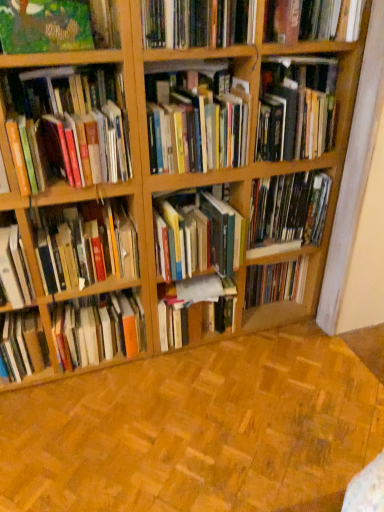
What do you see at coordinates (196, 234) in the screenshot?
I see `hardcover books at center, the eighth book from the top` at bounding box center [196, 234].

The width and height of the screenshot is (384, 512). I want to click on hardcover book at center, which is the twelfth book from top to bottom, so click(x=196, y=310).

What do you see at coordinates (275, 282) in the screenshot?
I see `hardcover book at center, positioned as the eleventh book in top-to-bottom order` at bounding box center [275, 282].

The width and height of the screenshot is (384, 512). Identify the location of hardcover book at center, marked as the third book in a bottom-to-top arrangement. (275, 282).

Locate an element on the screen. The image size is (384, 512). hardcover books at left, acting as the 8th book starting from the bottom is located at coordinates (67, 126).

Locate an element on the screen. The height and width of the screenshot is (512, 384). hardcover books at center, which appears as the sixth book when ordered from the bottom is located at coordinates (196, 234).

Does point (120, 352) come behind point (40, 160)?

Yes.

From the picture: Choose the correct answer: Is hardcover book at center, the first book ordered from the bottom, inside hardcover books at left, acting as the 8th book starting from the bottom, or outside it?

hardcover book at center, the first book ordered from the bottom, lies outside hardcover books at left, acting as the 8th book starting from the bottom.

Considering the relative sizes of hardcover book at center, which is the 13th book in top-to-bottom order, and hardcover books at left, the 6th book in the top-to-bottom sequence, in the image provided, is hardcover book at center, which is the 13th book in top-to-bottom order, taller than hardcover books at left, the 6th book in the top-to-bottom sequence,?

Yes.

Which object is thinner, hardcover book at center, which is the 13th book in top-to-bottom order, or hardcover books at left, acting as the 8th book starting from the bottom?

Thinner between the two is hardcover books at left, acting as the 8th book starting from the bottom.

Can you see hardcover books at center, marked as the 9th book in a bottom-to-top arrangement, touching hardcover books at left, the 6th book in the top-to-bottom sequence?

hardcover books at center, marked as the 9th book in a bottom-to-top arrangement, and hardcover books at left, the 6th book in the top-to-bottom sequence, are not in contact.

Considering the sizes of objects hardcover books at center, placed as the 5th book when sorted from top to bottom, and hardcover books at left, the 6th book in the top-to-bottom sequence, in the image provided, who is smaller, hardcover books at center, placed as the 5th book when sorted from top to bottom, or hardcover books at left, the 6th book in the top-to-bottom sequence,?

Smaller between the two is hardcover books at center, placed as the 5th book when sorted from top to bottom.

Is hardcover books at center, placed as the 5th book when sorted from top to bottom, completely or partially outside of hardcover books at left, the 6th book in the top-to-bottom sequence?

That's correct, hardcover books at center, placed as the 5th book when sorted from top to bottom, is outside of hardcover books at left, the 6th book in the top-to-bottom sequence.

Can you tell me how much hardcover books at center, placed as the 5th book when sorted from top to bottom, and hardcover books at left, acting as the 8th book starting from the bottom, differ in facing direction?

The angular difference between hardcover books at center, placed as the 5th book when sorted from top to bottom, and hardcover books at left, acting as the 8th book starting from the bottom, is 0.000763 degrees.

From the hardcover book at center, positioned as the eleventh book in top-to-bottom order, count the 3rd book to the left and point to it. Please provide its 2D coordinates.

[(196, 234)]

Is hardcover book at center, marked as the third book in a bottom-to-top arrangement, thinner than hardcover books at center, the eighth book from the top?

Indeed, hardcover book at center, marked as the third book in a bottom-to-top arrangement, has a lesser width compared to hardcover books at center, the eighth book from the top.

Looking at this image, in the image, is hardcover book at center, marked as the third book in a bottom-to-top arrangement, positioned in front of or behind hardcover books at center, which appears as the sixth book when ordered from the bottom?

hardcover book at center, marked as the third book in a bottom-to-top arrangement, is behind hardcover books at center, which appears as the sixth book when ordered from the bottom.

Is hardcover book at upper right, marked as the fourth book in a top-to-bottom arrangement, facing towards hardcover book at lower left, placed as the 10th book when sorted from top to bottom?

No, hardcover book at upper right, marked as the fourth book in a top-to-bottom arrangement, does not turn towards hardcover book at lower left, placed as the 10th book when sorted from top to bottom.

Which is further, (311, 153) or (24, 291)?

The point (311, 153) is farther.

From the picture: Measure the distance between hardcover book at upper right, the 10th book ordered from the bottom, and hardcover book at lower left, placed as the 10th book when sorted from top to bottom.

A distance of 1.03 meters exists between hardcover book at upper right, the 10th book ordered from the bottom, and hardcover book at lower left, placed as the 10th book when sorted from top to bottom.

From a real-world perspective, count 5th books upward from the hardcover book at lower left, the 4th book positioned from the bottom, and point to it. Please provide its 2D coordinates.

[(296, 108)]

Considering the points (136, 263) and (144, 341), which point is behind, point (136, 263) or point (144, 341)?

The point (144, 341) is farther.

Between hardcover book at center-left, which is the ninth book from top to bottom, and hardcover book at center, the first book ordered from the bottom, which one has smaller width?

Thinner between the two is hardcover book at center-left, which is the ninth book from top to bottom.

From a real-world perspective, does hardcover book at center-left, the 5th book when ordered from bottom to top, sit lower than hardcover book at center, which is the 13th book in top-to-bottom order?

No.

Where is `the 2nd book in front of the hardcover book at center, which is the 13th book in top-to-bottom order, counting from the anchor's position`? Image resolution: width=384 pixels, height=512 pixels. the 2nd book in front of the hardcover book at center, which is the 13th book in top-to-bottom order, counting from the anchor's position is located at coordinates (85, 246).

Between point (300, 259) and point (272, 217), which one is positioned behind?

The point (300, 259) is behind.

Can you confirm if hardcover book at center, positioned as the eleventh book in top-to-bottom order, is taller than hardcover book at center, the 7th book viewed from the top?

No, hardcover book at center, positioned as the eleventh book in top-to-bottom order, is not taller than hardcover book at center, the 7th book viewed from the top.

Considering the relative positions of hardcover book at center, marked as the third book in a bottom-to-top arrangement, and hardcover book at center, the 7th book viewed from the top, in the image provided, is hardcover book at center, marked as the third book in a bottom-to-top arrangement, to the left of hardcover book at center, the 7th book viewed from the top, from the viewer's perspective?

No, hardcover book at center, marked as the third book in a bottom-to-top arrangement, is not to the left of hardcover book at center, the 7th book viewed from the top.

Considering the relative sizes of hardcover book at upper right, the 10th book ordered from the bottom, and hardcover books at left, the 6th book in the top-to-bottom sequence, in the image provided, is hardcover book at upper right, the 10th book ordered from the bottom, smaller than hardcover books at left, the 6th book in the top-to-bottom sequence,?

Actually, hardcover book at upper right, the 10th book ordered from the bottom, might be larger than hardcover books at left, the 6th book in the top-to-bottom sequence.

From the image's perspective, is hardcover book at upper right, marked as the fourth book in a top-to-bottom arrangement, beneath hardcover books at left, acting as the 8th book starting from the bottom?

No, from the image's perspective, hardcover book at upper right, marked as the fourth book in a top-to-bottom arrangement, is not beneath hardcover books at left, acting as the 8th book starting from the bottom.

Consider the image. Is hardcover book at upper right, marked as the fourth book in a top-to-bottom arrangement, far from hardcover books at left, the 6th book in the top-to-bottom sequence?

No.

Is hardcover book at upper right, the 10th book ordered from the bottom, looking in the opposite direction of hardcover books at left, acting as the 8th book starting from the bottom?

That's not correct — hardcover book at upper right, the 10th book ordered from the bottom, is not looking away from hardcover books at left, acting as the 8th book starting from the bottom.

In order to click on the 7th book located above the hardcover book at center, the first book ordered from the bottom (from a real-world perspective) in this screenshot , I will do `click(67, 126)`.

Locate an element on the screen. the 3rd book counting from the right side of the hardcover books at left, acting as the 8th book starting from the bottom is located at coordinates (197, 120).

Looking at the image, which one is located further to hardcover book at center-left, which is the ninth book from top to bottom, hardcover book at center, which is the twelfth book from top to bottom, or hardcover book at upper right, marked as the fourth book in a top-to-bottom arrangement?

hardcover book at upper right, marked as the fourth book in a top-to-bottom arrangement.

Looking at the image, which one is located further to hardcover book at lower left, placed as the 10th book when sorted from top to bottom, hardcover book at center-left, the 5th book when ordered from bottom to top, or hardcover book at center, placed as the 7th book when sorted from bottom to top?

The object further to hardcover book at lower left, placed as the 10th book when sorted from top to bottom, is hardcover book at center, placed as the 7th book when sorted from bottom to top.

Estimate the real-world distances between objects in this image. Which object is closer to hardcover book at upper right, which is counted as the 1th book, starting from the top, hardcover books at center, placed as the 5th book when sorted from top to bottom, or hardcover book at center, placed as the 7th book when sorted from bottom to top?

hardcover books at center, placed as the 5th book when sorted from top to bottom, is positioned closer to the anchor hardcover book at upper right, which is counted as the 1th book, starting from the top.

When comparing their distances from hardcover book at center, the first book ordered from the bottom, does hardcover book at upper right, the 10th book ordered from the bottom, or hardcover book at center, placed as the 7th book when sorted from bottom to top, seem closer?

hardcover book at center, placed as the 7th book when sorted from bottom to top.

Looking at the image, which one is located further to hardcover books at center, the eighth book from the top, hardcover book at center, the 7th book viewed from the top, or hardcover books at left, acting as the 8th book starting from the bottom?

hardcover books at left, acting as the 8th book starting from the bottom, lies further to hardcover books at center, the eighth book from the top, than the other object.

Considering their positions, is hardcover book at center-left, the 5th book when ordered from bottom to top, positioned further to hardcover books at left, the 6th book in the top-to-bottom sequence, than hardcover book at lower left, the 4th book positioned from the bottom?

Based on the image, hardcover book at lower left, the 4th book positioned from the bottom, appears to be further to hardcover books at left, the 6th book in the top-to-bottom sequence.

Based on their spatial positions, is hardcover book at upper right, marked as the fourth book in a top-to-bottom arrangement, or hardcover book at center-left, which is the ninth book from top to bottom, further from hardcover books at center, which appears as the sixth book when ordered from the bottom?

Among the two, hardcover book at upper right, marked as the fourth book in a top-to-bottom arrangement, is located further to hardcover books at center, which appears as the sixth book when ordered from the bottom.

Based on their spatial positions, is hardcover books at center, the eighth book from the top, or green matte painting at upper left, which appears as the third book when viewed from the top, closer to hardcover books at center, marked as the 9th book in a bottom-to-top arrangement?

Based on the image, hardcover books at center, the eighth book from the top, appears to be nearer to hardcover books at center, marked as the 9th book in a bottom-to-top arrangement.